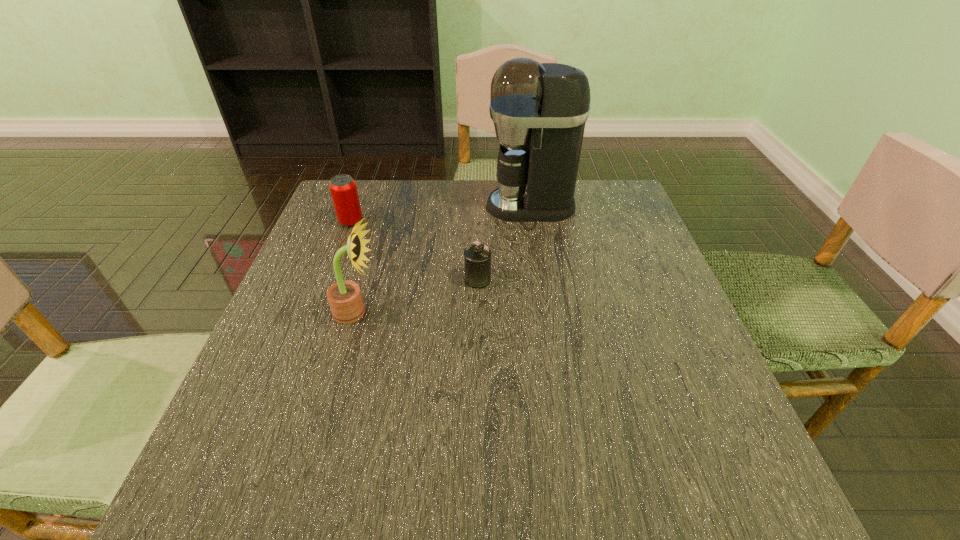
Where is `vacant space positioned 0.190m on the face of the third shortest object`? vacant space positioned 0.190m on the face of the third shortest object is located at coordinates (472, 312).

You are a GUI agent. You are given a task and a screenshot of the screen. Output one action in this format:
    pyautogui.click(x=<x>, y=<y>)
    Task: Click on the vacant position located 0.100m on the front of the taller can
    This screenshot has height=540, width=960.
    Given the screenshot: What is the action you would take?
    pyautogui.click(x=339, y=254)

At what (x,y) coordinates should I click in order to perform the action: click on vacant region located 0.330m on the front of the nearer can. Please return your answer as a coordinate pair (x, y). This screenshot has height=540, width=960. Looking at the image, I should click on (477, 431).

At what (x,y) coordinates should I click in order to perform the action: click on coffee maker that is at the far edge. Please return your answer as a coordinate pair (x, y). The image size is (960, 540). Looking at the image, I should click on (539, 110).

Where is `can that is positioned at the far edge`? can that is positioned at the far edge is located at coordinates (343, 189).

At what (x,y) coordinates should I click in order to perform the action: click on sunflower that is at the left edge. Please return your answer as a coordinate pair (x, y). Looking at the image, I should click on (345, 300).

The height and width of the screenshot is (540, 960). Find the location of `can that is at the left edge`. can that is at the left edge is located at coordinates (x=343, y=189).

The width and height of the screenshot is (960, 540). I want to click on object that is at the right edge, so click(x=539, y=110).

Locate an element on the screen. object that is at the far left corner is located at coordinates (343, 189).

The image size is (960, 540). Identify the location of object present at the far right corner. click(x=539, y=110).